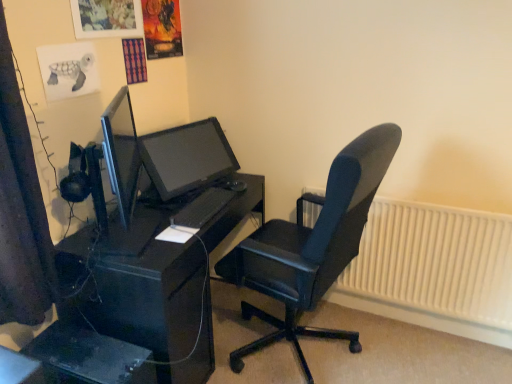
Where is `free space above black plastic computer tower at lower left (from a real-world perspective)`? The height and width of the screenshot is (384, 512). free space above black plastic computer tower at lower left (from a real-world perspective) is located at coordinates (82, 346).